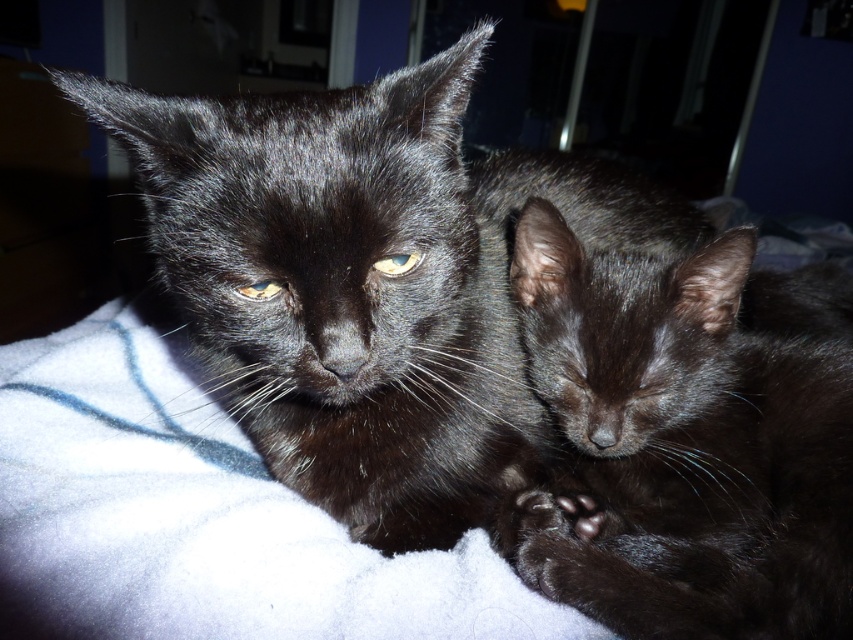
Can you confirm if shiny black kitten at center is positioned to the right of matte black eye at center?

Indeed, shiny black kitten at center is positioned on the right side of matte black eye at center.

Can you confirm if shiny black kitten at center is positioned below matte black eye at center?

Incorrect, shiny black kitten at center is not positioned below matte black eye at center.

Where is `shiny black kitten at center`? The image size is (853, 640). shiny black kitten at center is located at coordinates (685, 440).

Identify the location of shiny black cat at center. (367, 282).

Who is higher up, shiny black cat at center or matte yellow eye at upper left?

shiny black cat at center is higher up.

This screenshot has height=640, width=853. I want to click on shiny black cat at center, so click(367, 282).

Does point (637, 340) come farther from viewer compared to point (265, 291)?

Yes, it is behind point (265, 291).

Which is in front, point (646, 266) or point (279, 282)?

Point (279, 282) is in front.

Identify the location of shiny black kitten at center. (685, 440).